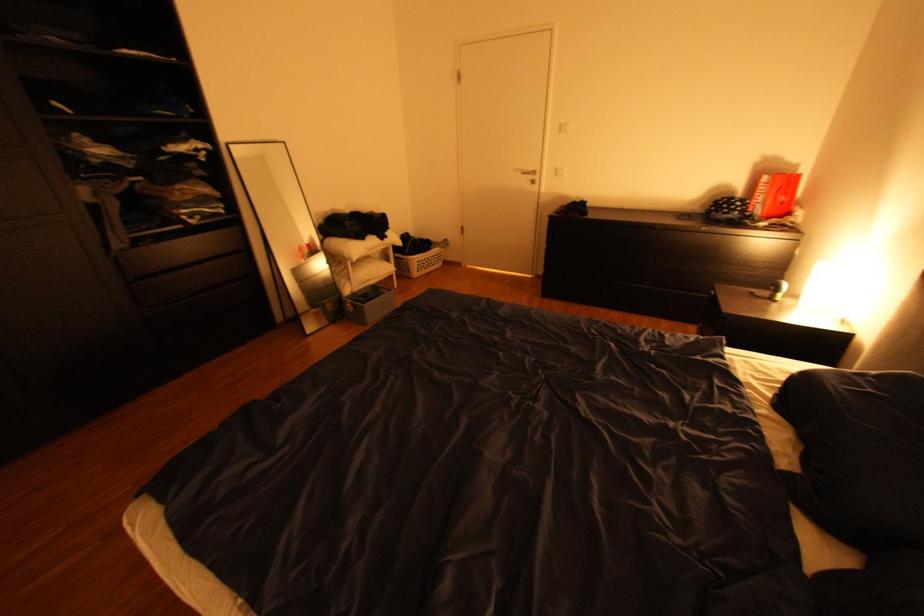
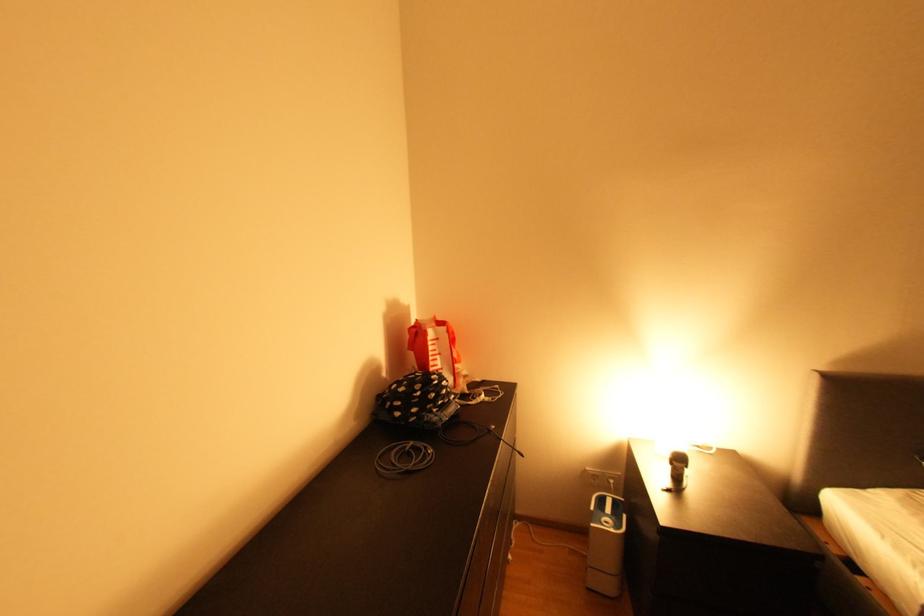
The point at [726,212] is marked in the first image. Where is the corresponding point in the second image?

(441, 411)